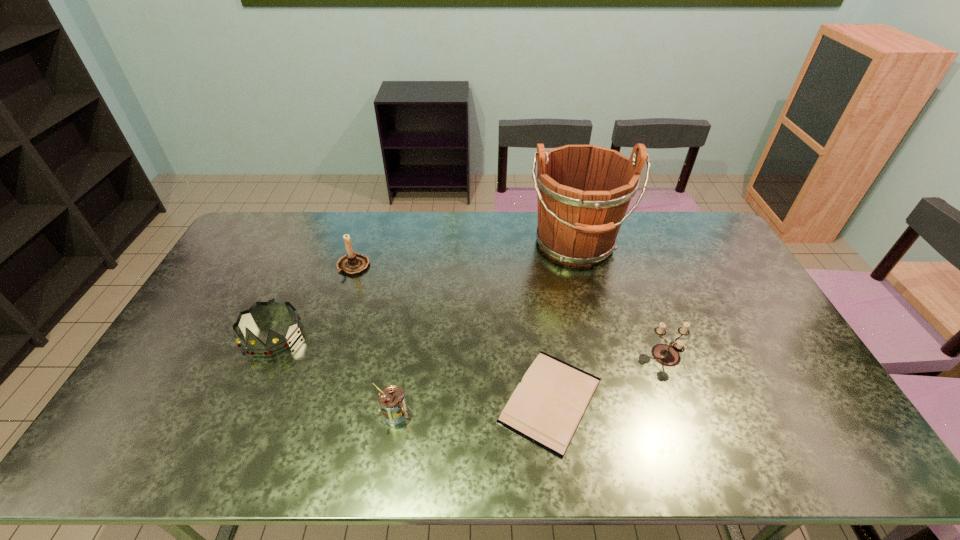
This screenshot has width=960, height=540. Identify the location of free space between the tiara and the can. (333, 374).

This screenshot has width=960, height=540. In order to click on free space between the hardback book and the second object from left to right in this screenshot , I will do `click(452, 333)`.

The width and height of the screenshot is (960, 540). What are the coordinates of `free space between the can and the farther candle holder` in the screenshot? It's located at (374, 340).

Identify which object is the third closest to the hardback book. Please provide its 2D coordinates. Your answer should be formatted as a tuple, i.e. [(x, y)], where the tuple contains the x and y coordinates of a point satisfying the conditions above.

[(583, 191)]

This screenshot has height=540, width=960. In order to click on object that stands as the fourth closest to the hardback book in this screenshot , I will do `click(352, 263)`.

I want to click on free space in the image that satisfies the following two spatial constraints: 1. on the front side of the left candle holder; 2. on the right side of the shortest object, so click(x=311, y=400).

What are the coordinates of `vacant space that satisfies the following two spatial constraints: 1. at the front of the leftmost object with jewels; 2. on the right side of the nearer candle holder` in the screenshot? It's located at (262, 357).

Image resolution: width=960 pixels, height=540 pixels. I want to click on vacant region that satisfies the following two spatial constraints: 1. on the front side of the hardback book; 2. on the right side of the fifth object from right to left, so click(311, 400).

Locate an element on the screen. free space that satisfies the following two spatial constraints: 1. with the handle on the side of the nearer candle holder; 2. on the left side of the bucket is located at coordinates (603, 357).